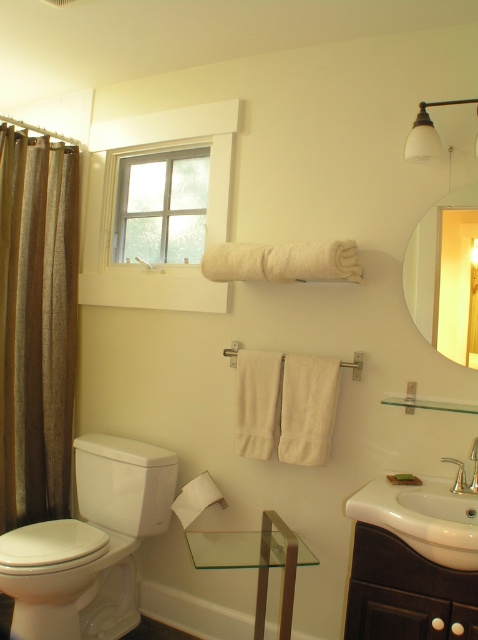
You are trying to clean the clear glass window at upper center but notice the brown textured shower curtain at left is blocking your view. Can you see the window through the shower curtain?

The brown textured shower curtain at left is in front of the clear glass window at upper center, so you cannot see the window through the shower curtain.

You are trying to place a decorative plant on the transparent glass table at center. However, there is a matte glass mirror at upper right above it. Will the mirror block sunlight coming through the window onto the plant?

The matte glass mirror at upper right is above the transparent glass table at center, so it may block some sunlight depending on the angle, but since mirrors reflect light, it might actually redirect sunlight towards the plant.

You are standing in the bathroom and want to open the clear glass window at upper center to let in some fresh air. Based on its position, where should you look to locate it?

The clear glass window at upper center is located at point 0.323 on the horizontal axis and 0.339 on the vertical axis, so you should look towards the upper center area of the bathroom to find it.